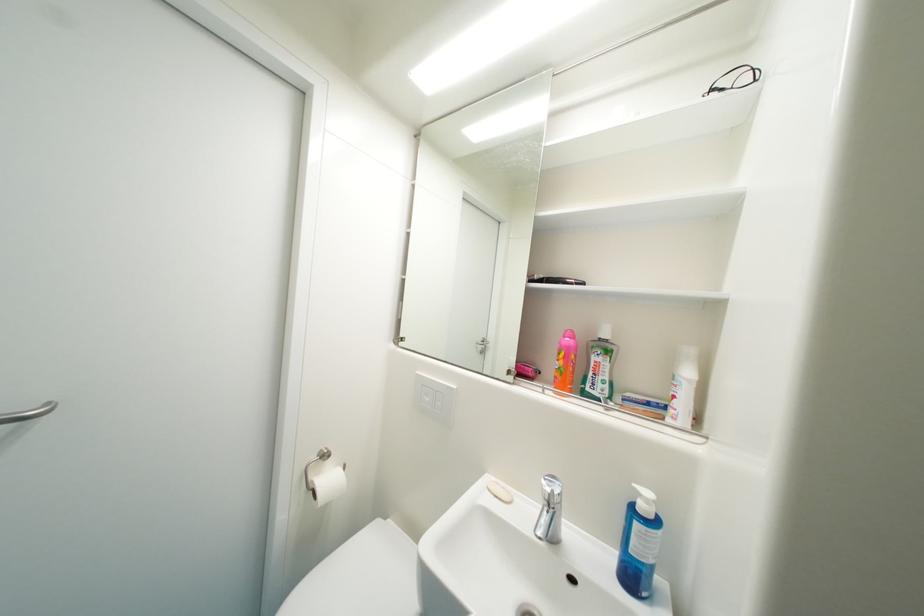
What do you see at coordinates (433, 398) in the screenshot?
I see `the white light switch` at bounding box center [433, 398].